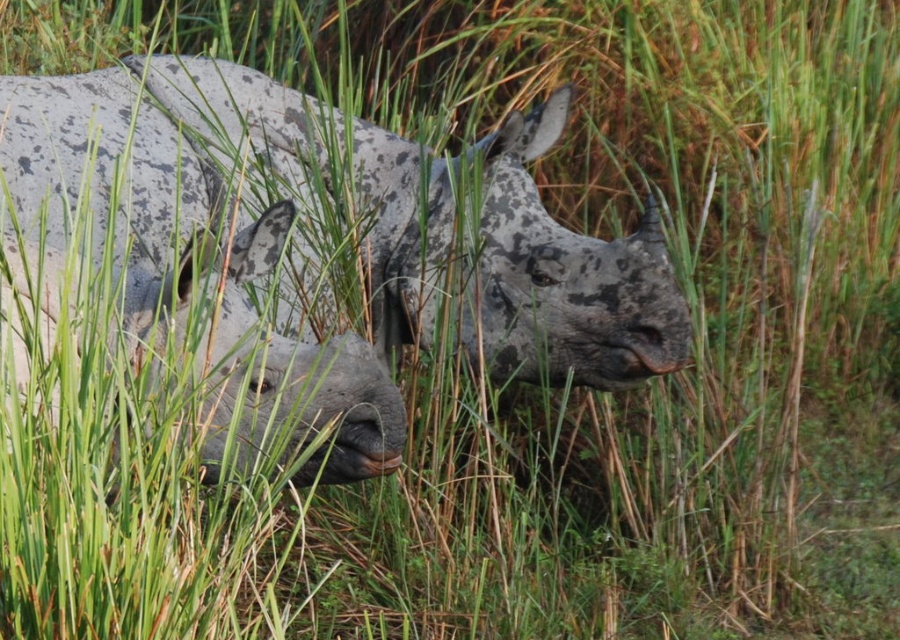
Question: Is speckled gray rhinoceros at center to the right of gray textured rhino at left from the viewer's perspective?

Choices:
 (A) no
 (B) yes

Answer: (B)

Question: Can you confirm if speckled gray rhinoceros at center is positioned above gray textured rhino at left?

Choices:
 (A) no
 (B) yes

Answer: (B)

Question: Is speckled gray rhinoceros at center thinner than gray textured rhino at left?

Choices:
 (A) no
 (B) yes

Answer: (A)

Question: Which of the following is the closest to the observer?

Choices:
 (A) [x=212, y=262]
 (B) [x=356, y=122]

Answer: (A)